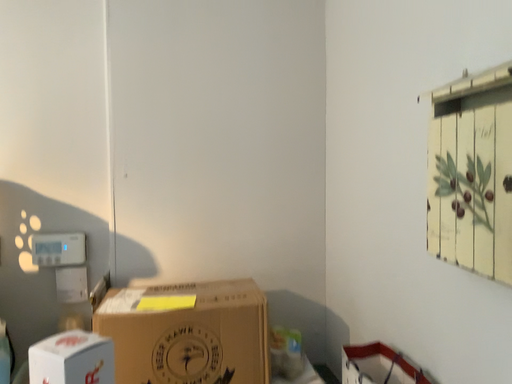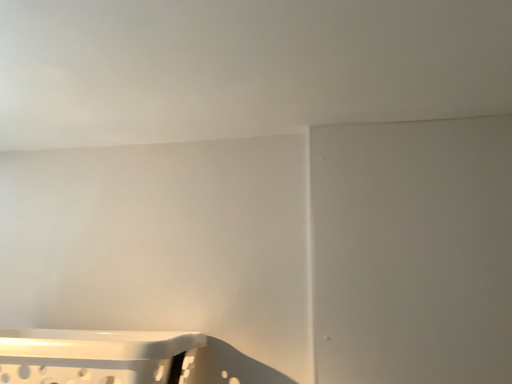
Question: Which way did the camera rotate in the video?

Choices:
 (A) rotated right
 (B) rotated left

Answer: (B)